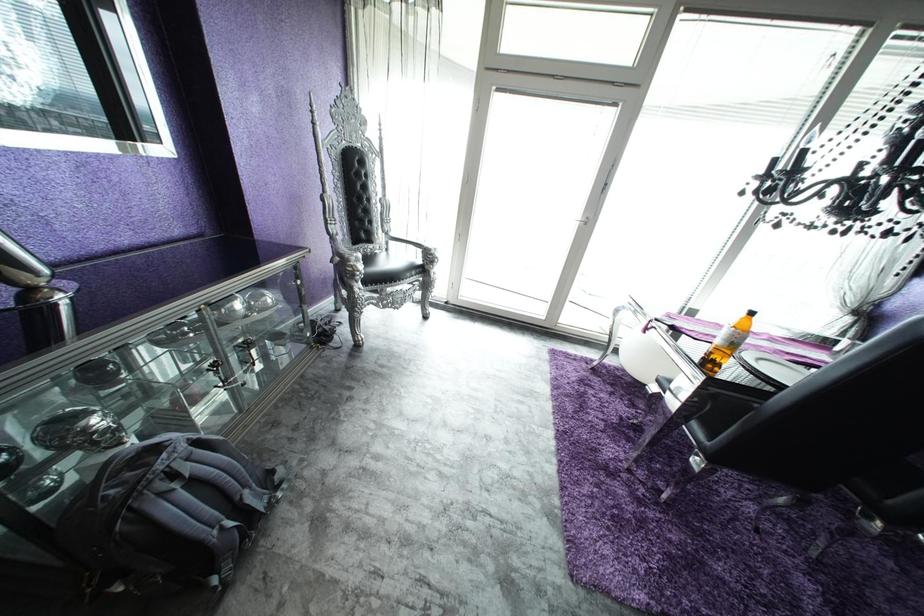
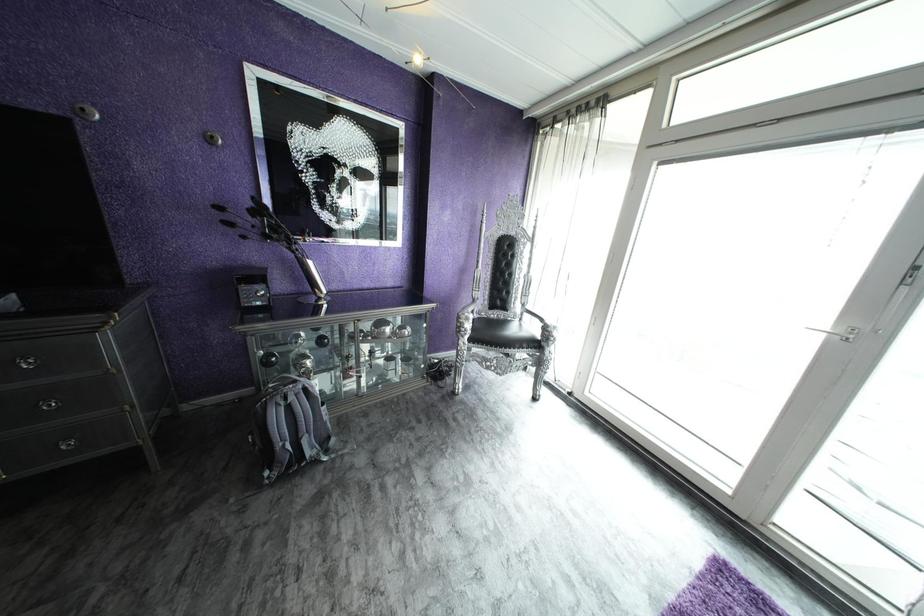
Question: Based on the continuous images, in which direction is the camera rotating? Reply with the corresponding letter.

Choices:
 (A) Left
 (B) Right
 (C) Up
 (D) Down

Answer: (A)